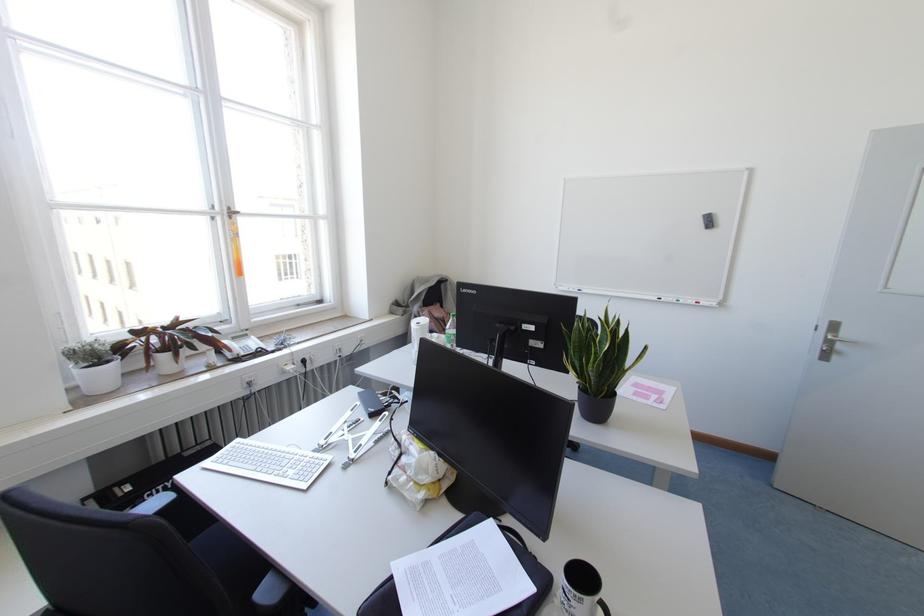
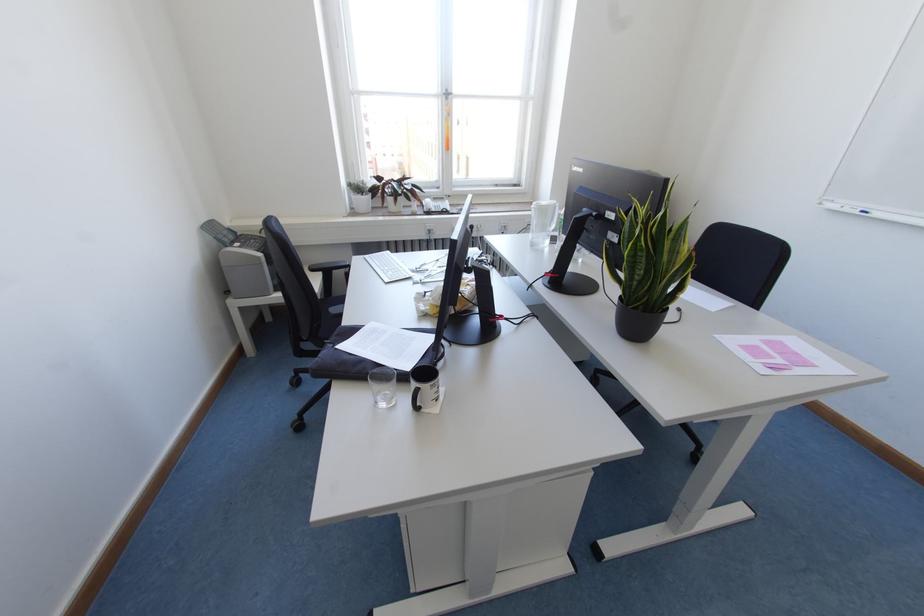
The point at (99, 363) is marked in the first image. Where is the corresponding point in the second image?

(361, 195)